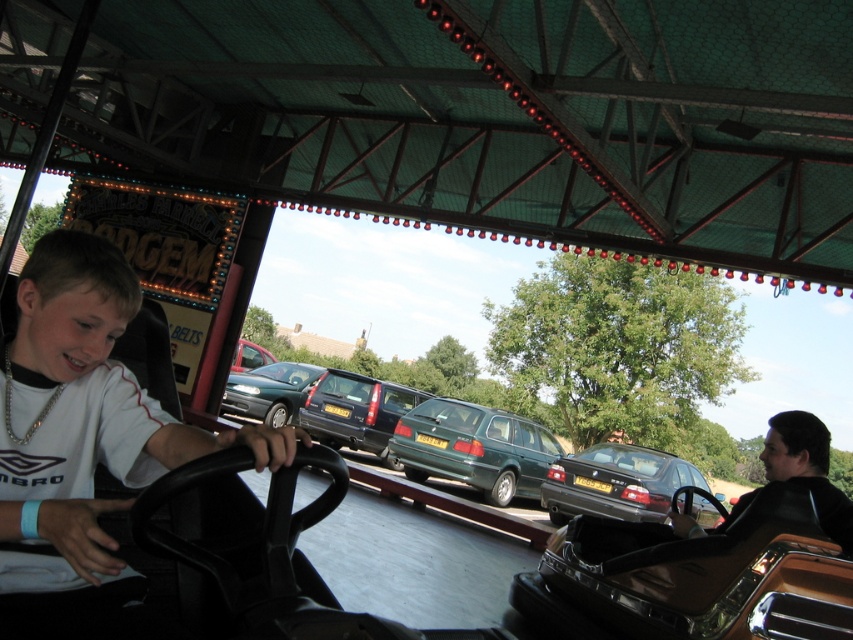
Question: Is white matte shirt at center to the right of metallic blue car at center from the viewer's perspective?

Choices:
 (A) no
 (B) yes

Answer: (B)

Question: Which object is closer to the camera taking this photo?

Choices:
 (A) metallic blue car at center
 (B) metallic silver car at center
 (C) green matte station wagon at center
 (D) white matte shirt at center

Answer: (D)

Question: Can you confirm if white matte shirt at center is wider than metallic silver car at center?

Choices:
 (A) yes
 (B) no

Answer: (B)

Question: In this image, where is white matte shirt at center located relative to shiny black car at right?

Choices:
 (A) left
 (B) right

Answer: (A)

Question: Estimate the real-world distances between objects in this image. Which object is closer to the green metallic car at center?

Choices:
 (A) shiny black sedan at center
 (B) shiny black car at right

Answer: (A)

Question: Which is farther from the green metallic car at center?

Choices:
 (A) green matte station wagon at center
 (B) shiny black car at right
 (C) metallic silver car at center

Answer: (B)